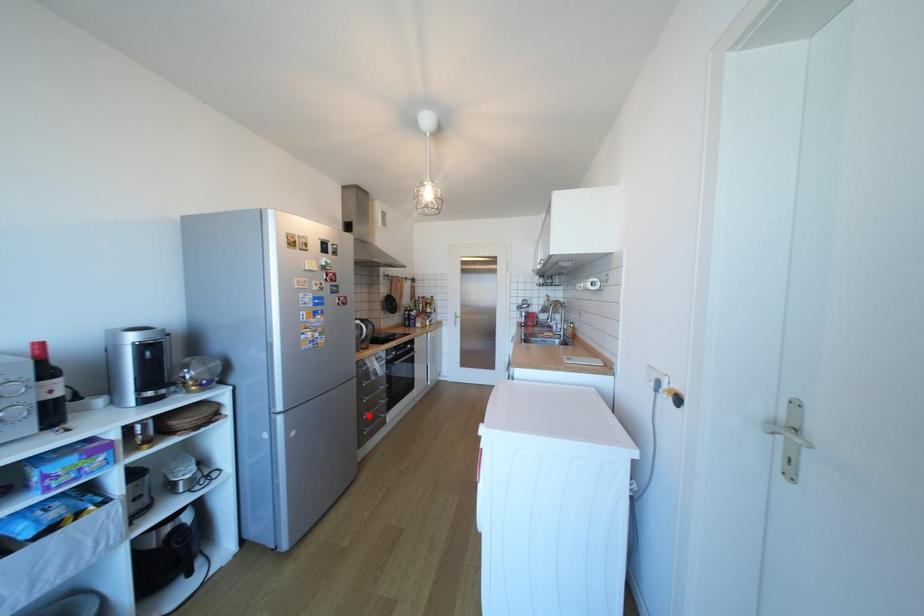
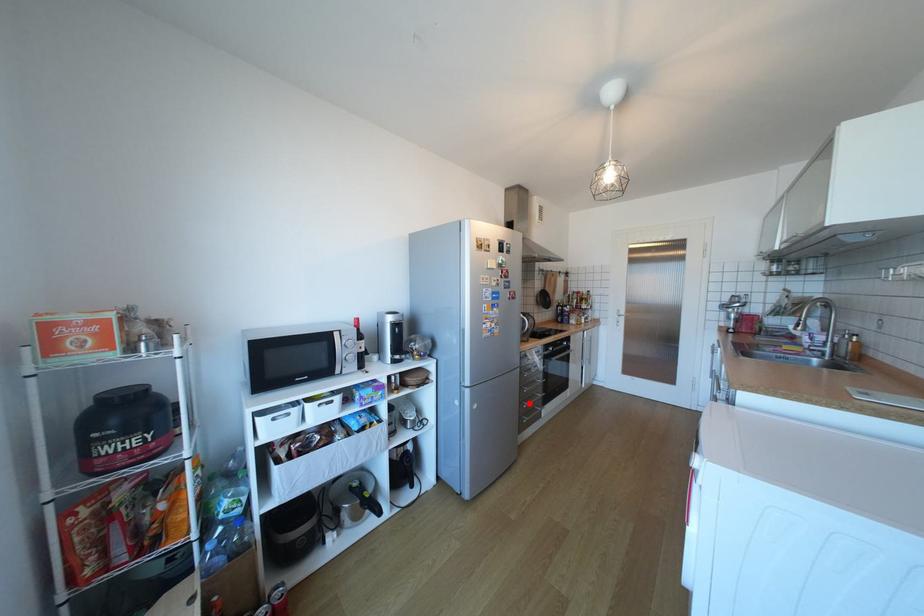
I am providing you with two images of the same scene from different viewpoints. A red point is marked on the first image and another point is marked on the second image. Do the highlighted points in image1 and image2 indicate the same real-world spot?

Yes